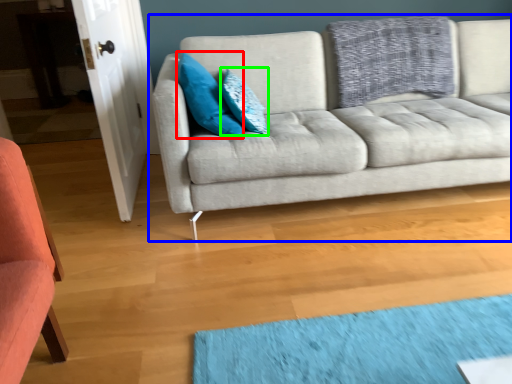
Question: Which object is the closest to the pillow (highlighted by a red box)? Choose among these: studio couch (highlighted by a blue box) or pillow (highlighted by a green box).

Choices:
 (A) studio couch
 (B) pillow

Answer: (B)